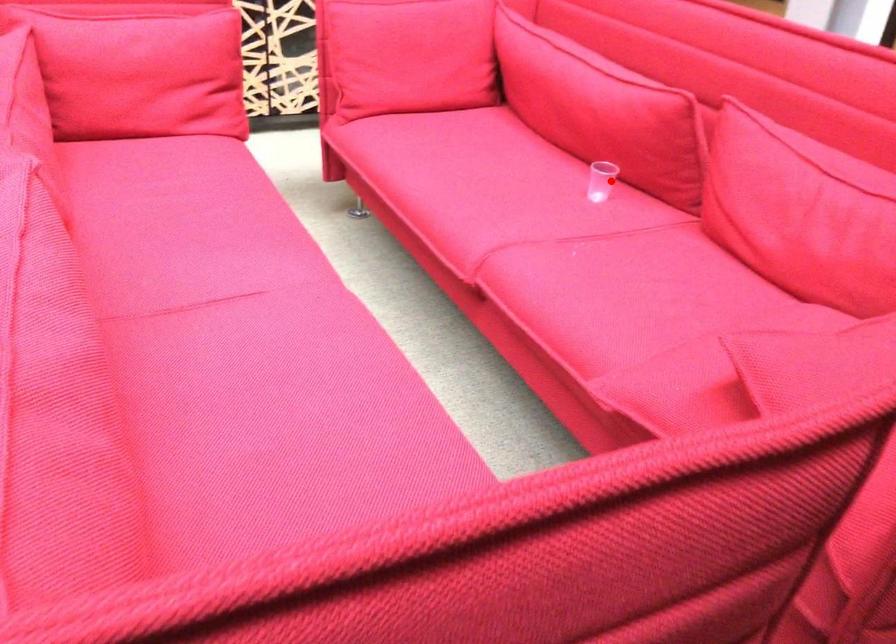
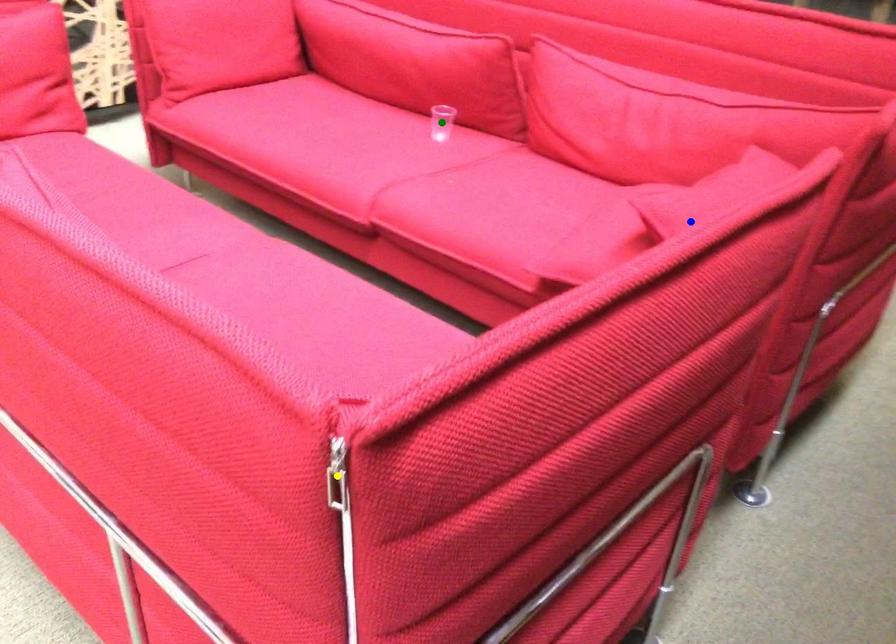
Question: I am providing you with two images of the same scene from different viewpoints. A red point is marked on the first image. You are given multiple points on the second image. Which point in image 2 is actually the same real-world point as the red point in image 1?

Choices:
 (A) yellow point
 (B) green point
 (C) blue point

Answer: (B)